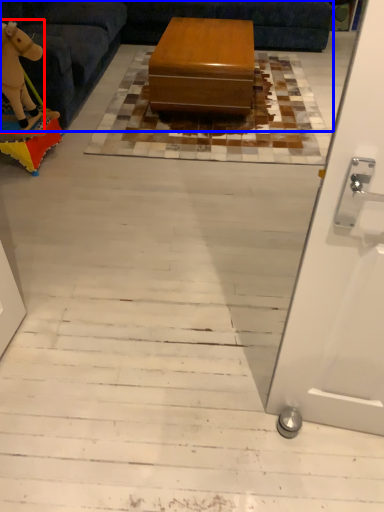
Question: Which object is further to the camera taking this photo, animal (highlighted by a red box) or couch (highlighted by a blue box)?

Choices:
 (A) animal
 (B) couch

Answer: (A)